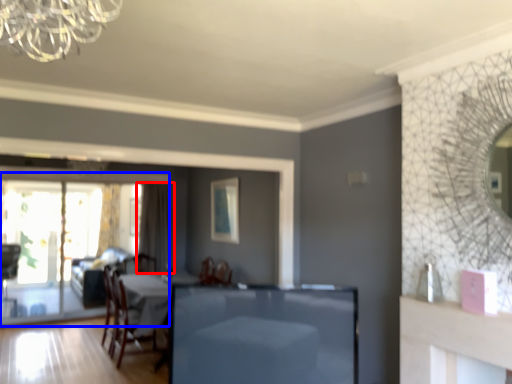
Question: Which object is further to the camera taking this photo, curtain (highlighted by a red box) or screen door (highlighted by a blue box)?

Choices:
 (A) curtain
 (B) screen door

Answer: (A)